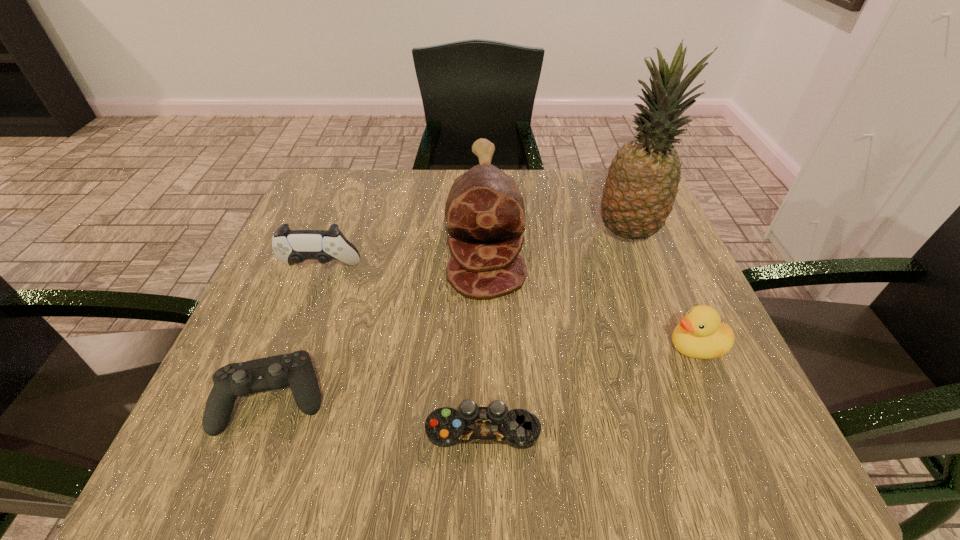
This screenshot has height=540, width=960. Find the location of `pineapple`. pineapple is located at coordinates (642, 184).

The height and width of the screenshot is (540, 960). I want to click on ham, so click(x=484, y=209).

Locate an element on the screen. The width and height of the screenshot is (960, 540). the tallest control is located at coordinates (290, 246).

The image size is (960, 540). What are the coordinates of `duckling` in the screenshot? It's located at (701, 335).

Find the location of a particular element. This screenshot has height=540, width=960. the second tallest control is located at coordinates (295, 370).

At what (x,y) coordinates should I click in order to perform the action: click on the shortest control. Please return your answer as a coordinate pair (x, y). Looking at the image, I should click on (445, 427).

Find the location of a particular element. This screenshot has height=540, width=960. the shortest object is located at coordinates (445, 427).

The image size is (960, 540). Identify the location of free point located on the left of the pineapple. (444, 233).

Locate an element on the screen. free space located at the sliced end of the ham is located at coordinates (488, 444).

Image resolution: width=960 pixels, height=540 pixels. I want to click on vacant space positioned on the front-facing side of the tallest control, so point(302,315).